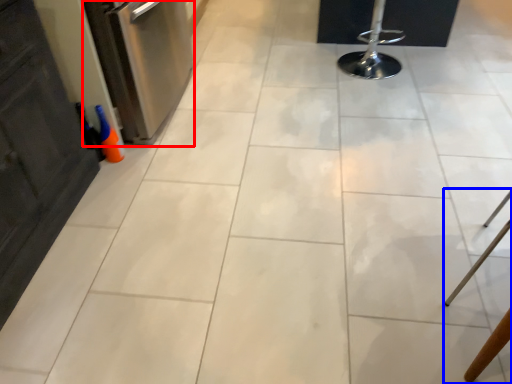
Question: Which of the following is the closest to the observer, dish washer (highlighted by a red box) or furniture (highlighted by a blue box)?

Choices:
 (A) dish washer
 (B) furniture

Answer: (B)